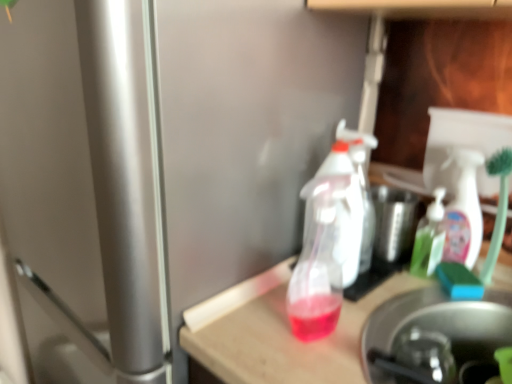
The width and height of the screenshot is (512, 384). I want to click on unoccupied area in front of translucent plastic spray bottle at center, which appears as the 2th bottle when viewed from the right, so click(x=315, y=364).